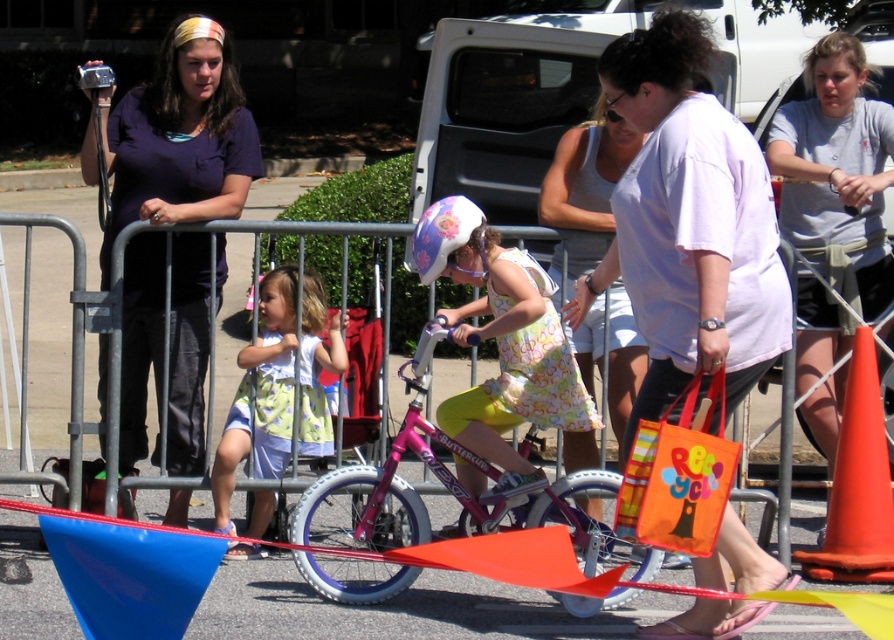
Who is taller, gray cotton t-shirt at upper right or light green floral dress at center?

With more height is gray cotton t-shirt at upper right.

Does point (863, 172) come in front of point (301, 417)?

No, (863, 172) is behind (301, 417).

I want to click on gray cotton t-shirt at upper right, so click(x=836, y=173).

Which of these two, matte purple shirt at upper left or floral dress at center, stands taller?

matte purple shirt at upper left is taller.

Is matte purple shirt at upper left in front of floral dress at center?

No, matte purple shirt at upper left is behind floral dress at center.

Does point (228, 81) come behind point (576, 420)?

Yes, it is.

The width and height of the screenshot is (894, 640). Identify the location of matte purple shirt at upper left. 181,136.

Based on the photo, is gray cotton t-shirt at upper right bigger than floral dress at center?

Correct, gray cotton t-shirt at upper right is larger in size than floral dress at center.

Does gray cotton t-shirt at upper right appear on the right side of floral dress at center?

Indeed, gray cotton t-shirt at upper right is positioned on the right side of floral dress at center.

Does point (854, 116) lie behind point (419, 241)?

Yes, it is behind point (419, 241).

This screenshot has width=894, height=640. In order to click on gray cotton t-shirt at upper right in this screenshot , I will do `click(836, 173)`.